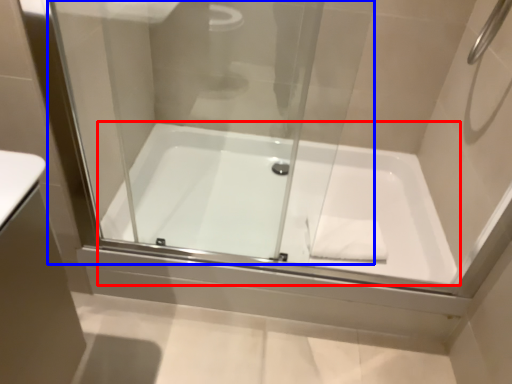
Question: Among these objects, which one is nearest to the camera, bathtub (highlighted by a red box) or glass door (highlighted by a blue box)?

Choices:
 (A) bathtub
 (B) glass door

Answer: (B)